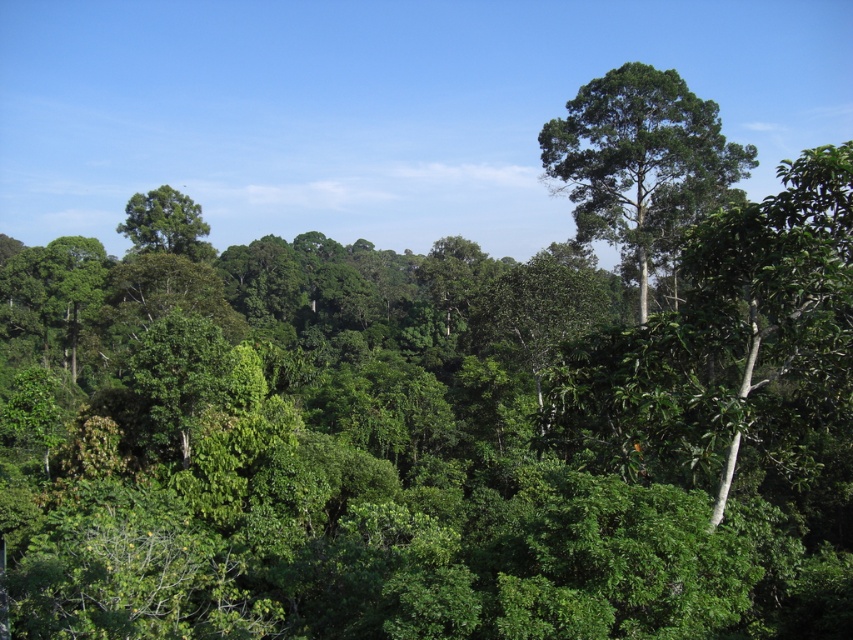
Question: Considering the relative positions of green leafy tree at upper right and green leafy tree at upper left in the image provided, where is green leafy tree at upper right located with respect to green leafy tree at upper left?

Choices:
 (A) above
 (B) below

Answer: (B)

Question: Is green leafy tree at upper right closer to camera compared to green leafy tree at upper left?

Choices:
 (A) no
 (B) yes

Answer: (B)

Question: Where is green leafy tree at upper right located in relation to green leafy tree at upper left in the image?

Choices:
 (A) above
 (B) below

Answer: (B)

Question: Which point is farther to the camera?

Choices:
 (A) green leafy tree at upper right
 (B) green leafy tree at upper left

Answer: (B)